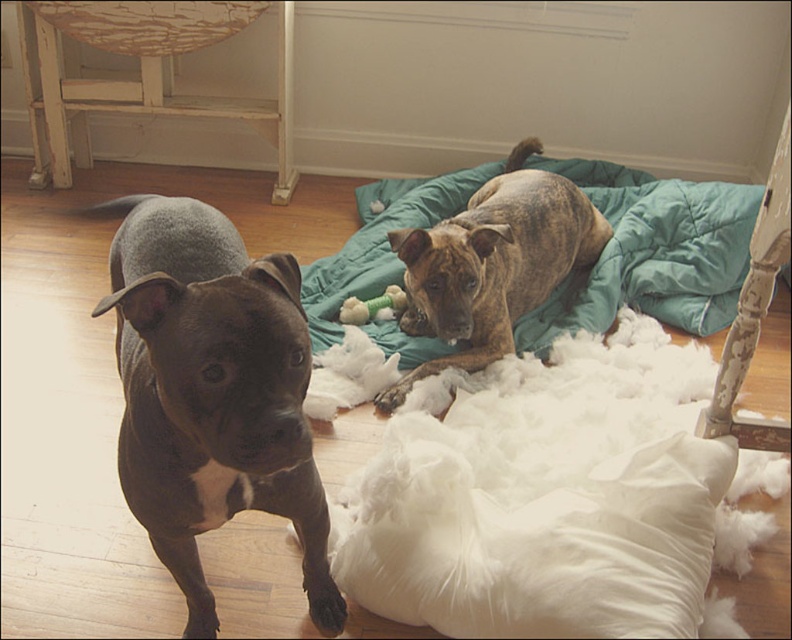
Question: Which object appears farthest from the camera in this image?

Choices:
 (A) teal quilted blanket at upper right
 (B) teal quilted dog bed at upper center
 (C) green plush toy at center
 (D) brown brindle dog at upper center

Answer: (C)

Question: Among these points, which one is farthest from the camera?

Choices:
 (A) (268, 481)
 (B) (406, 305)
 (C) (669, 200)

Answer: (C)

Question: Does brown brindle dog at upper center come behind green plush toy at center?

Choices:
 (A) yes
 (B) no

Answer: (B)

Question: Can you confirm if teal quilted blanket at upper right is positioned above green plush toy at center?

Choices:
 (A) yes
 (B) no

Answer: (A)

Question: Considering the real-world distances, which object is farthest from the teal quilted dog bed at upper center?

Choices:
 (A) green plush toy at center
 (B) shiny brown fur at left
 (C) brown brindle dog at upper center

Answer: (B)

Question: Is shiny brown fur at left wider than brown brindle dog at upper center?

Choices:
 (A) no
 (B) yes

Answer: (A)